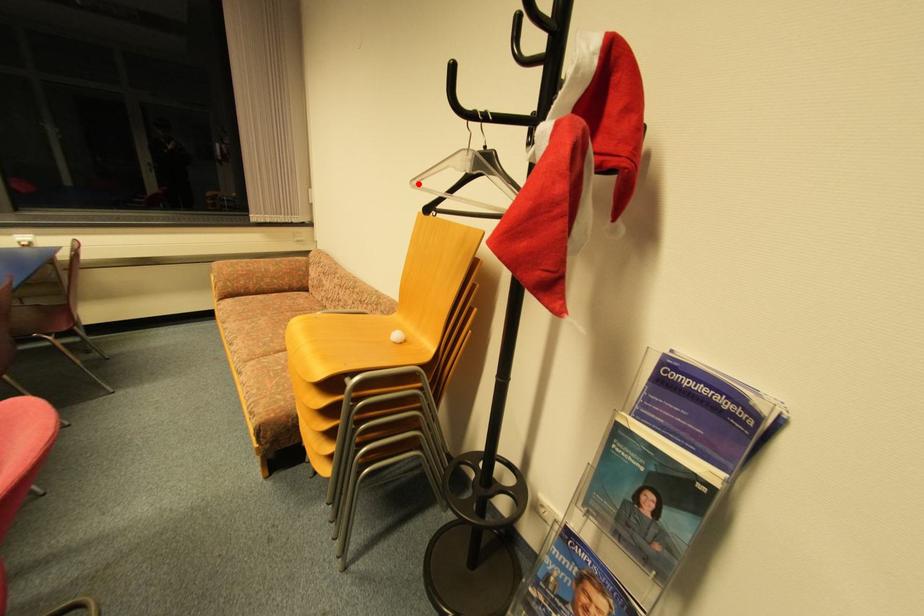
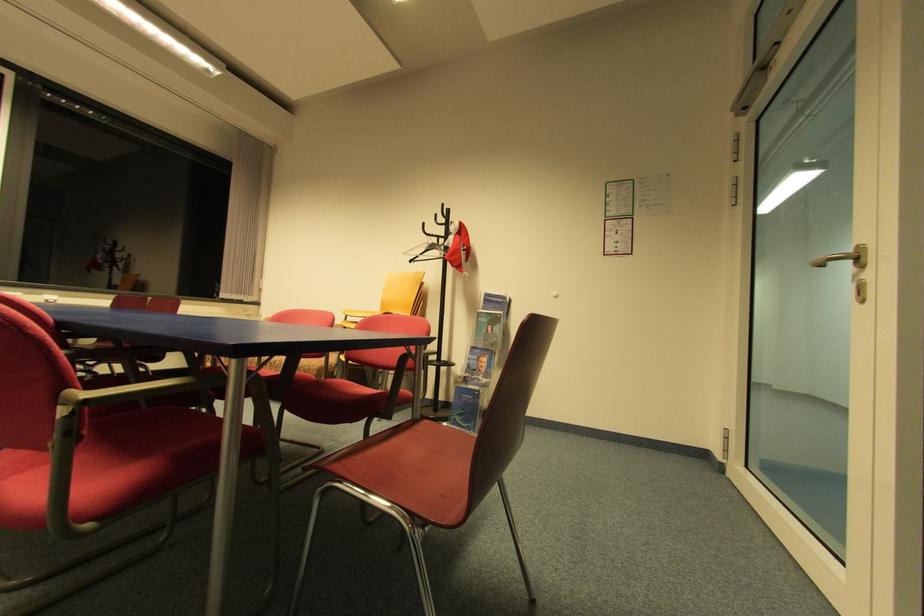
The point at the highlighted location is marked in the first image. Where is the corresponding point in the second image?

(408, 254)